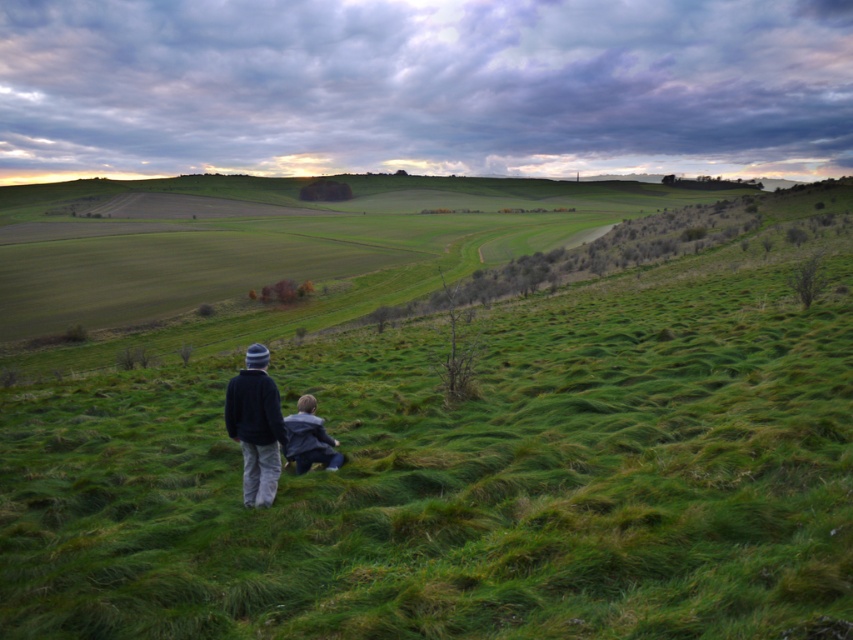
Question: Does green grassy hillside at center appear over blue denim jacket at lower center?

Choices:
 (A) no
 (B) yes

Answer: (B)

Question: Which object is positioned closest to the blue denim jacket at lower center?

Choices:
 (A) dark blue sweater at center
 (B) green grassy hillside at center

Answer: (A)

Question: Among these points, which one is nearest to the camera?

Choices:
 (A) (258, 342)
 (B) (701, 400)

Answer: (B)

Question: Is dark blue sweater at center wider than blue denim jacket at lower center?

Choices:
 (A) yes
 (B) no

Answer: (B)

Question: Is the position of green grassy hillside at center less distant than that of dark blue sweater at center?

Choices:
 (A) yes
 (B) no

Answer: (A)

Question: Estimate the real-world distances between objects in this image. Which object is farther from the green grassy hillside at center?

Choices:
 (A) dark blue sweater at center
 (B) blue denim jacket at lower center

Answer: (A)